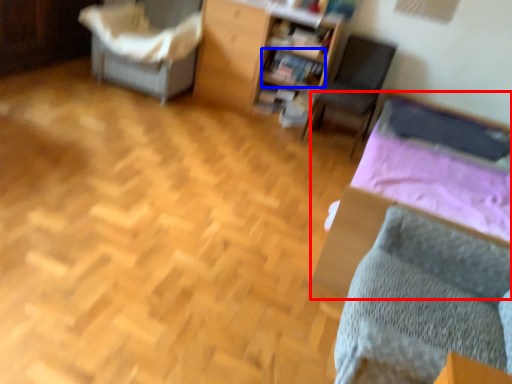
Question: Which of the following is the closest to the observer, bed (highlighted by a red box) or book (highlighted by a blue box)?

Choices:
 (A) bed
 (B) book

Answer: (A)